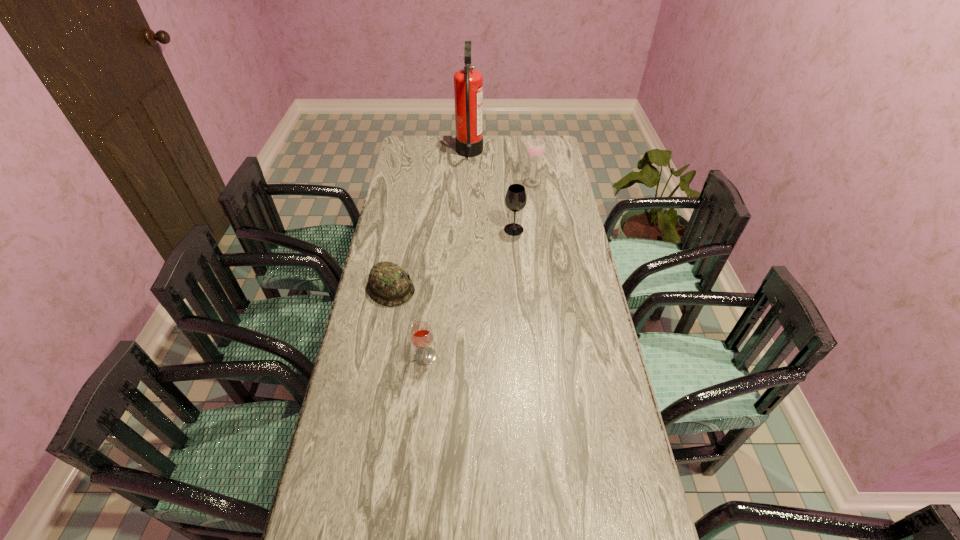
Locate an element on the screen. This screenshot has height=540, width=960. vacant space at the far left corner of the desktop is located at coordinates (413, 144).

Identify the location of empty location between the nearest wineglass and the rightmost object. Image resolution: width=960 pixels, height=540 pixels. (479, 269).

The image size is (960, 540). Find the location of `empty location between the leftmost wineglass and the rightmost object`. empty location between the leftmost wineglass and the rightmost object is located at coordinates (479, 269).

Locate an element on the screen. free space between the second nearest object and the third object from right to left is located at coordinates (430, 221).

At what (x,y) coordinates should I click in order to perform the action: click on empty space that is in between the tallest object and the second nearest object. Please return your answer as a coordinate pair (x, y). Looking at the image, I should click on (x=430, y=221).

The image size is (960, 540). I want to click on empty space between the leftmost object and the third farthest object, so click(x=452, y=259).

At what (x,y) coordinates should I click in order to perform the action: click on unoccupied area between the third nearest object and the fourth farthest object. Please return your answer as a coordinate pair (x, y). The height and width of the screenshot is (540, 960). Looking at the image, I should click on (452, 259).

You are a GUI agent. You are given a task and a screenshot of the screen. Output one action in this format:
    pyautogui.click(x=<x>, y=<y>)
    Task: Click on the vacant area that lies between the second wineglass from left to right and the farthest object
    
    Given the screenshot: What is the action you would take?
    pyautogui.click(x=492, y=192)

Find the location of `free spot between the fourth farthest object and the second farthest wineglass`. free spot between the fourth farthest object and the second farthest wineglass is located at coordinates (452, 259).

In order to click on blank region between the tallest object and the farthest wineglass in this screenshot , I will do `click(501, 168)`.